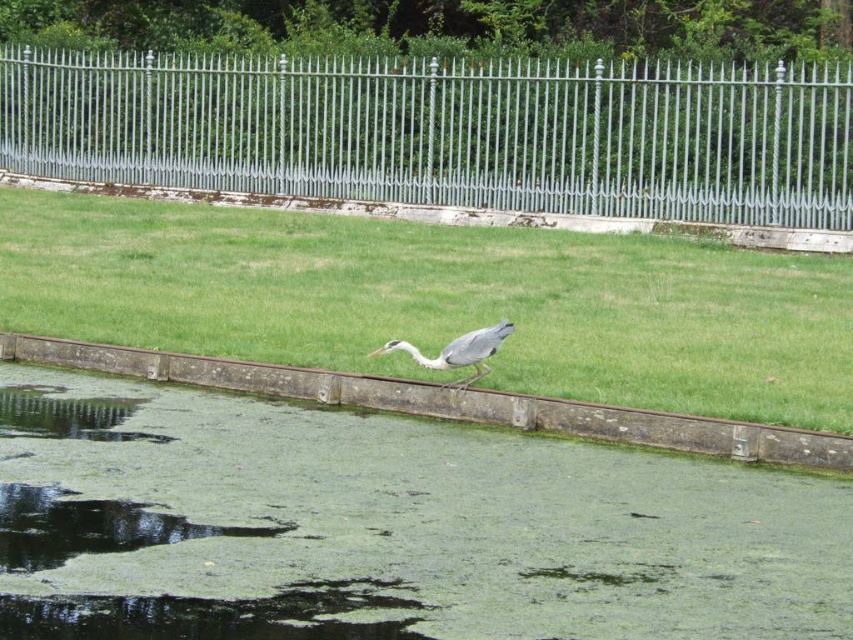
The width and height of the screenshot is (853, 640). What do you see at coordinates (387, 528) in the screenshot? I see `green algae-covered water at center` at bounding box center [387, 528].

Identify the location of green algae-covered water at center. pyautogui.click(x=387, y=528).

Between point (250, 106) and point (808, 438), which one is positioned behind?

Point (250, 106)

Locate an element on the screen. The width and height of the screenshot is (853, 640). silver metallic fence at upper center is located at coordinates (445, 131).

In order to click on silver metallic fence at upper center in this screenshot , I will do `click(445, 131)`.

Is brown concrete ledge at center smaller than gray matte bird at center?

Actually, brown concrete ledge at center might be larger than gray matte bird at center.

What do you see at coordinates (448, 403) in the screenshot? The width and height of the screenshot is (853, 640). I see `brown concrete ledge at center` at bounding box center [448, 403].

The width and height of the screenshot is (853, 640). I want to click on brown concrete ledge at center, so click(x=448, y=403).